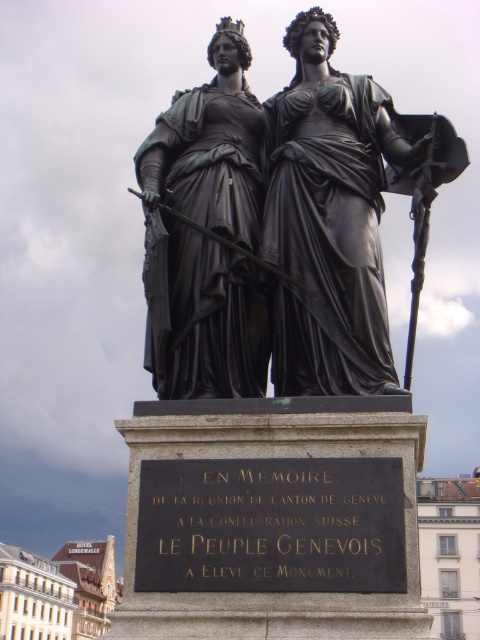
Does black polished statue at center have a greater width compared to matte black statue at center?

Correct, the width of black polished statue at center exceeds that of matte black statue at center.

Is black polished statue at center to the left of matte black statue at center from the viewer's perspective?

No, black polished statue at center is not to the left of matte black statue at center.

Between point (369, 292) and point (220, 291), which one is positioned in front?

Point (220, 291) is in front.

Identify the location of black polished statue at center. (328, 218).

Does matte black statue at center come behind black metal plaque at center?

Yes, matte black statue at center is behind black metal plaque at center.

Does point (241, 148) come behind point (211, 548)?

Yes, point (241, 148) is behind point (211, 548).

I want to click on matte black statue at center, so click(204, 236).

Between black polished statue at center and black metal plaque at center, which one appears on the left side from the viewer's perspective?

black metal plaque at center

Image resolution: width=480 pixels, height=640 pixels. I want to click on black polished statue at center, so click(x=328, y=218).

Where is `black polished statue at center`? black polished statue at center is located at coordinates (328, 218).